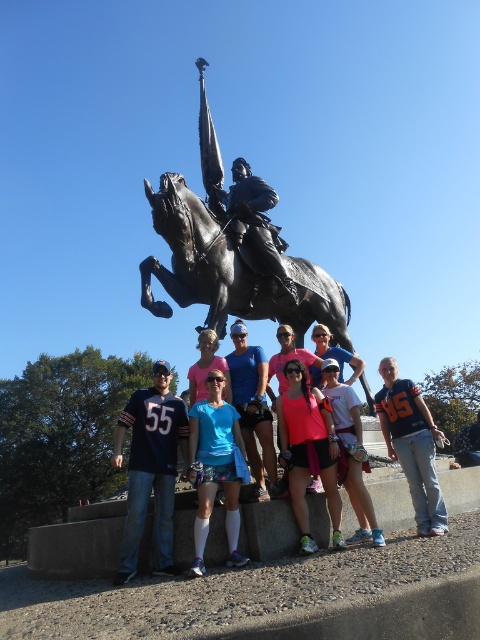
Does bronze/statue at center appear under polished bronze statue at center?

Yes.

Is bronze/statue at center positioned before polished bronze statue at center?

Yes, it is in front of polished bronze statue at center.

Is point (310, 268) closer to camera compared to point (231, 166)?

Yes.

Where is `bronze/statue at center`? The width and height of the screenshot is (480, 640). bronze/statue at center is located at coordinates (230, 273).

Between point (163, 486) and point (229, 433), which one is positioned in front?

Positioned in front is point (163, 486).

Describe the element at coordinates (151, 468) in the screenshot. The height and width of the screenshot is (640, 480). I see `blue jersey at center` at that location.

Identify the location of blue jersey at center. The height and width of the screenshot is (640, 480). pos(151,468).

Who is shorter, blue fabric shorts at center or polished bronze statue at center?

Standing shorter between the two is blue fabric shorts at center.

Is blue fabric shorts at center in front of polished bronze statue at center?

Yes, it is.

Is point (203, 410) closer to camera compared to point (265, 236)?

Yes, point (203, 410) is closer to viewer.

Locate an element on the screen. Image resolution: width=480 pixels, height=640 pixels. blue fabric shorts at center is located at coordinates (216, 468).